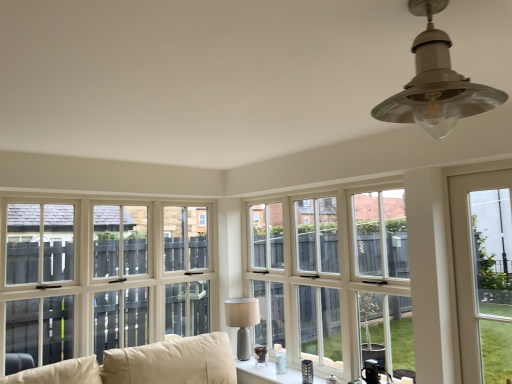
Question: Which direction should I rotate to look at satin silver lampshade at upper center, the 1th lamp viewed from the front, — up or down?

Choices:
 (A) up
 (B) down

Answer: (A)

Question: Which direction should I rotate to face white wood window at center, acting as the 2th window starting from the left, — up or down?

Choices:
 (A) down
 (B) up

Answer: (A)

Question: Can clear glass door at right, the 1th window viewed from the right, be found inside beige fabric couch at lower left?

Choices:
 (A) no
 (B) yes

Answer: (A)

Question: Considering the relative sizes of beige fabric couch at lower left and clear glass door at right, arranged as the 3th window when viewed from the left, in the image provided, is beige fabric couch at lower left wider than clear glass door at right, arranged as the 3th window when viewed from the left,?

Choices:
 (A) yes
 (B) no

Answer: (A)

Question: Is beige fabric couch at lower left positioned before clear glass door at right, the 1th window viewed from the right?

Choices:
 (A) no
 (B) yes

Answer: (B)

Question: Would you say beige fabric couch at lower left is a long distance from clear glass door at right, the 1th window viewed from the right?

Choices:
 (A) no
 (B) yes

Answer: (B)

Question: Could you tell me if beige fabric couch at lower left is facing clear glass door at right, the 1th window viewed from the right?

Choices:
 (A) no
 (B) yes

Answer: (A)

Question: Can we say beige fabric couch at lower left lies outside clear glass door at right, arranged as the 3th window when viewed from the left?

Choices:
 (A) no
 (B) yes

Answer: (B)

Question: Can you confirm if satin silver lampshade at upper center, the second lamp in the bottom-to-top sequence, is wider than matte gray lamp at center, which ranks as the second lamp in front-to-back order?

Choices:
 (A) no
 (B) yes

Answer: (B)

Question: Is satin silver lampshade at upper center, which is the second lamp from back to front, turned away from matte gray lamp at center, the 1th lamp when ordered from back to front?

Choices:
 (A) yes
 (B) no

Answer: (B)

Question: Considering the relative sizes of satin silver lampshade at upper center, which is counted as the second lamp, starting from the left, and matte gray lamp at center, which is the second lamp from top to bottom, in the image provided, is satin silver lampshade at upper center, which is counted as the second lamp, starting from the left, taller than matte gray lamp at center, which is the second lamp from top to bottom,?

Choices:
 (A) no
 (B) yes

Answer: (A)

Question: Can you confirm if satin silver lampshade at upper center, the second lamp in the bottom-to-top sequence, is shorter than matte gray lamp at center, placed as the 1th lamp when sorted from left to right?

Choices:
 (A) yes
 (B) no

Answer: (A)

Question: From a real-world perspective, is satin silver lampshade at upper center, the 1th lamp when ordered from right to left, positioned over matte gray lamp at center, the 2th lamp in the right-to-left sequence, based on gravity?

Choices:
 (A) yes
 (B) no

Answer: (A)

Question: Are satin silver lampshade at upper center, which is counted as the second lamp, starting from the left, and matte gray lamp at center, which is the second lamp from top to bottom, located far from each other?

Choices:
 (A) yes
 (B) no

Answer: (A)

Question: Is satin silver lampshade at upper center, which is the second lamp from back to front, smaller than white wood window at center, which appears as the second window when viewed from the right?

Choices:
 (A) yes
 (B) no

Answer: (A)